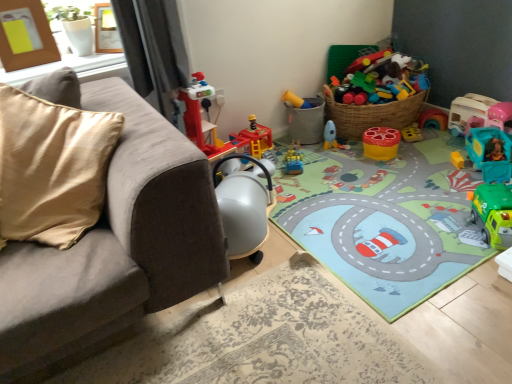
The image size is (512, 384). In order to click on free spot in front of matte plastic bucket at center, the 5th toy when ordered from right to left in this screenshot , I will do `click(317, 150)`.